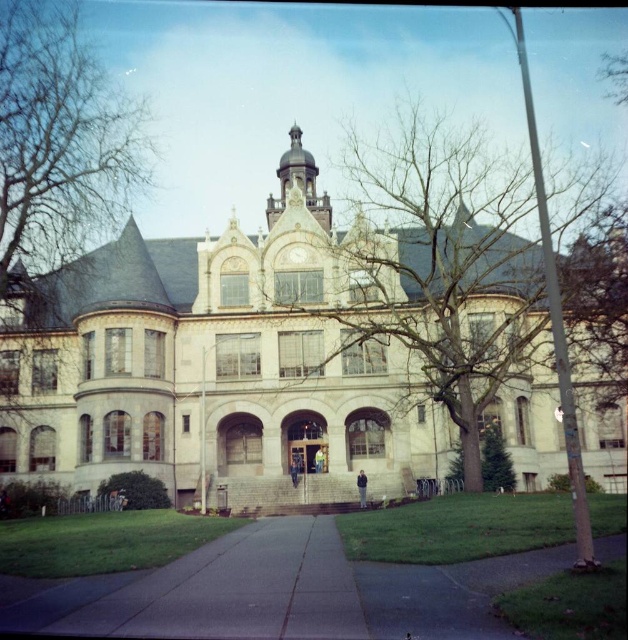
Question: Does white stone mansion at center appear over smooth asphalt path at center?

Choices:
 (A) no
 (B) yes

Answer: (B)

Question: Is white stone mansion at center smaller than smooth asphalt path at center?

Choices:
 (A) no
 (B) yes

Answer: (A)

Question: Which object is closer to the camera taking this photo?

Choices:
 (A) white stone mansion at center
 (B) smooth asphalt path at center

Answer: (B)

Question: Is white stone mansion at center bigger than smooth asphalt path at center?

Choices:
 (A) yes
 (B) no

Answer: (A)

Question: Which point appears closest to the camera in this image?

Choices:
 (A) (202, 618)
 (B) (293, 456)

Answer: (A)